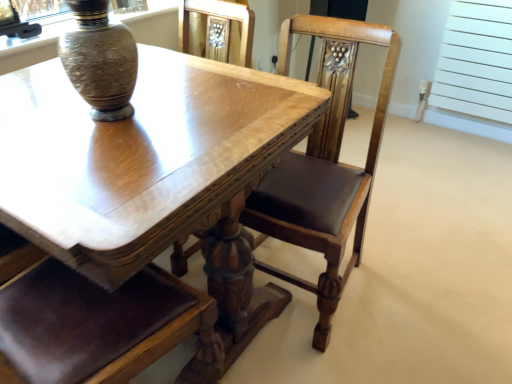
Measure the distance between polished wood chair at center and camera.

They are 1.16 meters apart.

At what (x,y) coordinates should I click in order to perform the action: click on speckled ceramic vase at upper left. Please return your answer as a coordinate pair (x, y). Looking at the image, I should click on (100, 60).

Locate an element on the screen. shiny wood table at center is located at coordinates (133, 209).

Which object is closer to the camera, speckled ceramic vase at upper left or polished wood chair at center?

speckled ceramic vase at upper left is in front.

Locate an element on the screen. vase above the polished wood chair at center (from the image's perspective) is located at coordinates (100, 60).

Is speckled ceramic vase at upper left smaller than polished wood chair at center?

Indeed, speckled ceramic vase at upper left has a smaller size compared to polished wood chair at center.

Is speckled ceramic vase at upper left not inside shiny wood table at center?

Yes, speckled ceramic vase at upper left is located beyond the bounds of shiny wood table at center.

Is point (125, 65) closer or farther from the camera than point (220, 246)?

Point (125, 65) appears to be closer to the viewer than point (220, 246).

Which object is thinner, speckled ceramic vase at upper left or shiny wood table at center?

Thinner between the two is speckled ceramic vase at upper left.

You are a GUI agent. You are given a task and a screenshot of the screen. Output one action in this format:
    pyautogui.click(x=<x>, y=<y>)
    Task: Click on the screen door lying above the polished wood chair at center (from the image's perspective)
    The height and width of the screenshot is (384, 512).
    Given the screenshot: What is the action you would take?
    pyautogui.click(x=476, y=60)

Which of these two, polished wood chair at center or white matte radiator at upper right, is wider?

With larger width is polished wood chair at center.

Could you tell me if polished wood chair at center is facing white matte radiator at upper right?

No, polished wood chair at center is not facing towards white matte radiator at upper right.

Which is more to the left, polished wood chair at center or white matte radiator at upper right?

Positioned to the left is polished wood chair at center.

Is shiny wood table at center in front of white matte radiator at upper right?

Yes, shiny wood table at center is in front of white matte radiator at upper right.

Is shiny wood table at center wider or thinner than white matte radiator at upper right?

Considering their sizes, shiny wood table at center looks broader than white matte radiator at upper right.

Does point (83, 303) lie behind point (435, 96)?

No, (83, 303) is closer to viewer.

Locate an element on the screen. Image resolution: width=512 pixels, height=384 pixels. screen door lying above the shiny wood table at center (from the image's perspective) is located at coordinates (476, 60).

From the image's perspective, does white matte radiator at upper right appear lower than shiny wood table at center?

No, from the image's perspective, white matte radiator at upper right is not beneath shiny wood table at center.

Is white matte radiator at upper right positioned far away from shiny wood table at center?

Yes.

Is white matte radiator at upper right bigger than shiny wood table at center?

No, white matte radiator at upper right is not bigger than shiny wood table at center.

Is white matte radiator at upper right completely or partially outside of shiny wood table at center?

white matte radiator at upper right lies outside shiny wood table at center's area.

Is there a large distance between shiny wood table at center and speckled ceramic vase at upper left?

shiny wood table at center is near speckled ceramic vase at upper left, not far away.

Does shiny wood table at center turn towards speckled ceramic vase at upper left?

No, shiny wood table at center is not oriented towards speckled ceramic vase at upper left.

Is shiny wood table at center shorter than speckled ceramic vase at upper left?

No, shiny wood table at center is not shorter than speckled ceramic vase at upper left.

Does point (302, 91) appear closer or farther from the camera than point (84, 74)?

Point (302, 91) appears to be farther away from the viewer than point (84, 74).

Does speckled ceramic vase at upper left contain white matte radiator at upper right?

No, speckled ceramic vase at upper left does not contain white matte radiator at upper right.

From a real-world perspective, is speckled ceramic vase at upper left located beneath white matte radiator at upper right?

Actually, speckled ceramic vase at upper left is physically above white matte radiator at upper right in the real world.

From the image's perspective, is speckled ceramic vase at upper left beneath white matte radiator at upper right?

Correct, speckled ceramic vase at upper left appears lower than white matte radiator at upper right in the image.

Considering the relative sizes of speckled ceramic vase at upper left and white matte radiator at upper right in the image provided, is speckled ceramic vase at upper left thinner than white matte radiator at upper right?

Result: No, speckled ceramic vase at upper left is not thinner than white matte radiator at upper right.

Where is `vase in front of the polished wood chair at center`? The height and width of the screenshot is (384, 512). vase in front of the polished wood chair at center is located at coordinates (100, 60).

In order to click on vase above the shiny wood table at center (from the image's perspective) in this screenshot , I will do `click(100, 60)`.

Based on their spatial positions, is shiny wood table at center or white matte radiator at upper right further from speckled ceramic vase at upper left?

white matte radiator at upper right is positioned further to the anchor speckled ceramic vase at upper left.

Looking at the image, which one is located closer to white matte radiator at upper right, polished wood chair at center or speckled ceramic vase at upper left?

polished wood chair at center.

Which object lies nearer to the anchor point white matte radiator at upper right, speckled ceramic vase at upper left or shiny wood table at center?

Among the two, shiny wood table at center is located nearer to white matte radiator at upper right.

When comparing their distances from polished wood chair at center, does shiny wood table at center or white matte radiator at upper right seem closer?

The object closer to polished wood chair at center is shiny wood table at center.

From the image, which object appears to be nearer to speckled ceramic vase at upper left, shiny wood table at center or polished wood chair at center?

Among the two, shiny wood table at center is located nearer to speckled ceramic vase at upper left.

When comparing their distances from white matte radiator at upper right, does shiny wood table at center or speckled ceramic vase at upper left seem closer?

shiny wood table at center is positioned closer to the anchor white matte radiator at upper right.

Based on their spatial positions, is polished wood chair at center or shiny wood table at center further from speckled ceramic vase at upper left?

Among the two, polished wood chair at center is located further to speckled ceramic vase at upper left.

Which object lies nearer to the anchor point white matte radiator at upper right, speckled ceramic vase at upper left or polished wood chair at center?

polished wood chair at center.

This screenshot has width=512, height=384. What are the coordinates of `vase located between shiny wood table at center and white matte radiator at upper right in the left-right direction` in the screenshot? It's located at (100, 60).

What are the coordinates of `vase between shiny wood table at center and polished wood chair at center` in the screenshot? It's located at (100, 60).

The image size is (512, 384). Identify the location of chair located between speckled ceramic vase at upper left and white matte radiator at upper right in the left-right direction. (324, 166).

Locate an element on the screen. This screenshot has width=512, height=384. chair between shiny wood table at center and white matte radiator at upper right from left to right is located at coordinates (324, 166).